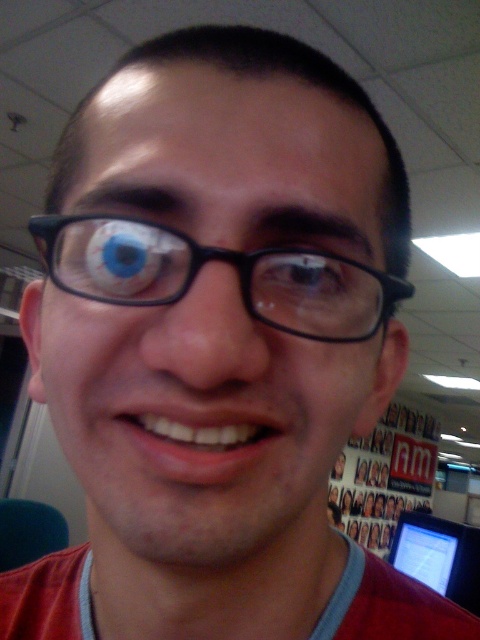
Does black plastic glasses at center come in front of brown matte eye at center?

Yes, it is.

Is the position of black plastic glasses at center more distant than that of brown matte eye at center?

No, it is not.

This screenshot has width=480, height=640. Describe the element at coordinates (218, 260) in the screenshot. I see `black plastic glasses at center` at that location.

This screenshot has height=640, width=480. I want to click on black plastic glasses at center, so click(x=218, y=260).

Between point (360, 337) and point (428, 536), which one is positioned in front?

Point (360, 337)

Does black plastic glasses at center have a smaller size compared to matte plastic computer screen at lower right?

Yes, black plastic glasses at center is smaller than matte plastic computer screen at lower right.

Is point (365, 321) farther from viewer compared to point (444, 536)?

That is False.

Identify the location of black plastic glasses at center. (218, 260).

Based on the photo, does matte plastic computer screen at lower right appear under brown matte eye at center?

Correct, matte plastic computer screen at lower right is located below brown matte eye at center.

Is matte plastic computer screen at lower right closer to camera compared to brown matte eye at center?

No, matte plastic computer screen at lower right is behind brown matte eye at center.

Which is behind, point (456, 593) or point (344, 300)?

The point (456, 593) is more distant.

I want to click on matte plastic computer screen at lower right, so click(x=439, y=556).